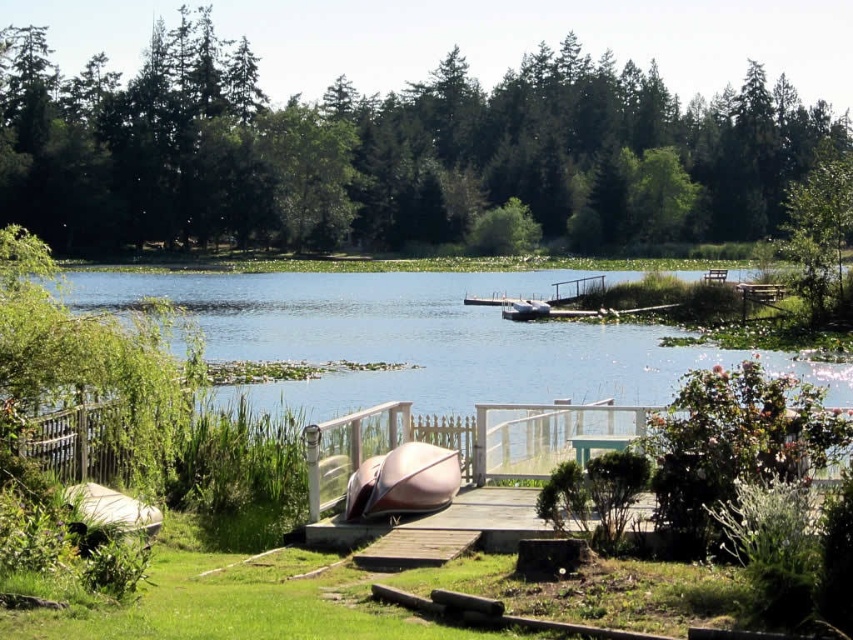
Which is more to the left, green matte tree at upper center or wooden dock at center?

wooden dock at center

What do you see at coordinates (389, 150) in the screenshot?
I see `green matte tree at upper center` at bounding box center [389, 150].

Find the location of a particular element. The height and width of the screenshot is (640, 853). green matte tree at upper center is located at coordinates (389, 150).

Based on the photo, between wooden dock at center and metallic pink canoe at center, which one is positioned higher?

wooden dock at center is higher up.

Does wooden dock at center have a larger size compared to metallic pink canoe at center?

Indeed, wooden dock at center has a larger size compared to metallic pink canoe at center.

Image resolution: width=853 pixels, height=640 pixels. I want to click on wooden dock at center, so click(460, 467).

Does green leafy tree at upper right appear on the left side of metallic pink canoe at center?

Incorrect, green leafy tree at upper right is not on the left side of metallic pink canoe at center.

Image resolution: width=853 pixels, height=640 pixels. I want to click on green leafy tree at upper right, so click(820, 227).

At what (x,y) coordinates should I click in order to perform the action: click on green leafy tree at upper right. Please return your answer as a coordinate pair (x, y). Looking at the image, I should click on click(x=820, y=227).